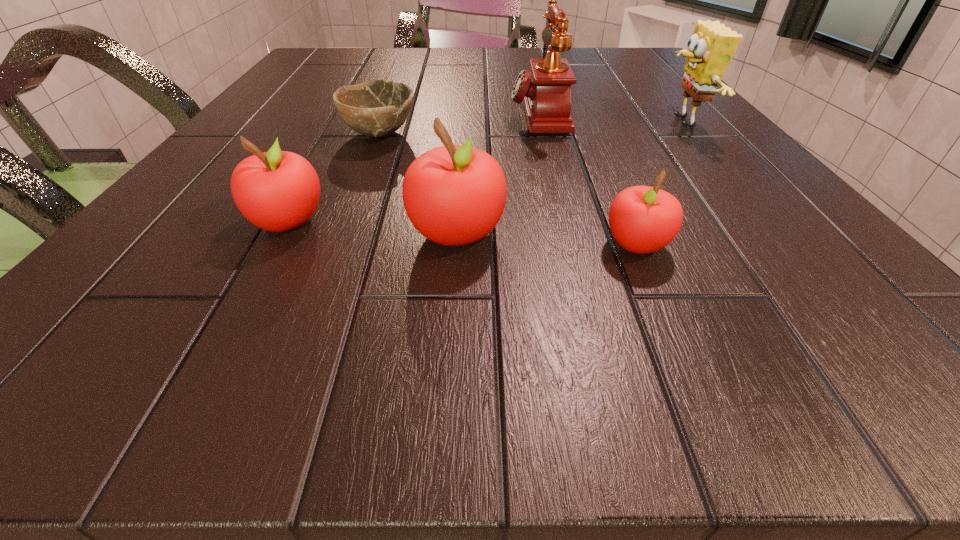
This screenshot has width=960, height=540. Identify the location of object at the right edge. (711, 47).

This screenshot has height=540, width=960. Identify the location of object located at the near left corner. (277, 191).

In order to click on free space at the far edge of the desktop in this screenshot , I will do `click(449, 53)`.

Locate an element on the screen. This screenshot has height=540, width=960. free space at the near edge is located at coordinates (318, 254).

Locate an element on the screen. The height and width of the screenshot is (540, 960). vacant space at the left edge of the desktop is located at coordinates tap(345, 78).

In order to click on blank space at the right edge of the desktop in this screenshot , I will do `click(686, 150)`.

At what (x,y) coordinates should I click in order to perform the action: click on free space at the far left corner. Please return your answer as a coordinate pair (x, y). The image size is (960, 540). Looking at the image, I should click on (346, 64).

At what (x,y) coordinates should I click in order to perform the action: click on vacant region at the near right corner of the desktop. Please return your answer as a coordinate pair (x, y). This screenshot has width=960, height=540. Looking at the image, I should click on (778, 246).

This screenshot has width=960, height=540. I want to click on empty space between the sponge and the telephone, so click(610, 119).

Where is `vacant area that lies between the rightmost object and the telephone`? This screenshot has width=960, height=540. vacant area that lies between the rightmost object and the telephone is located at coordinates (610, 119).